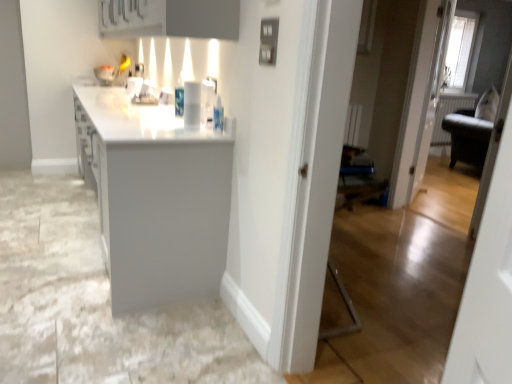
Question: From the image's perspective, would you say white glossy cup at center is positioned over matte gray cabinet at upper center?

Choices:
 (A) yes
 (B) no

Answer: (B)

Question: Considering the relative positions of white glossy cup at center and matte gray cabinet at upper center in the image provided, is white glossy cup at center to the left of matte gray cabinet at upper center from the viewer's perspective?

Choices:
 (A) yes
 (B) no

Answer: (B)

Question: Is white glossy cup at center not near matte gray cabinet at upper center?

Choices:
 (A) no
 (B) yes

Answer: (A)

Question: Is the depth of white glossy cup at center greater than that of matte gray cabinet at upper center?

Choices:
 (A) yes
 (B) no

Answer: (A)

Question: Is white glossy cup at center oriented away from matte gray cabinet at upper center?

Choices:
 (A) yes
 (B) no

Answer: (B)

Question: In terms of size, does matte gray cabinet at upper center appear bigger or smaller than white glossy countertop at center?

Choices:
 (A) small
 (B) big

Answer: (A)

Question: Considering the positions of matte gray cabinet at upper center and white glossy countertop at center in the image, is matte gray cabinet at upper center wider or thinner than white glossy countertop at center?

Choices:
 (A) thin
 (B) wide

Answer: (A)

Question: Visually, is matte gray cabinet at upper center positioned to the left or to the right of white glossy countertop at center?

Choices:
 (A) left
 (B) right

Answer: (B)

Question: From a real-world perspective, is matte gray cabinet at upper center physically located above or below white glossy countertop at center?

Choices:
 (A) above
 (B) below

Answer: (A)

Question: Considering the positions of point (128, 31) and point (200, 94), is point (128, 31) closer or farther from the camera than point (200, 94)?

Choices:
 (A) closer
 (B) farther

Answer: (B)

Question: In the image, is matte gray cabinet at upper center on the left side or the right side of white glossy cup at center?

Choices:
 (A) right
 (B) left

Answer: (B)

Question: Is matte gray cabinet at upper center taller or shorter than white glossy cup at center?

Choices:
 (A) tall
 (B) short

Answer: (A)

Question: Is matte gray cabinet at upper center wider or thinner than white glossy cup at center?

Choices:
 (A) wide
 (B) thin

Answer: (A)

Question: From the image's perspective, is white glossy cup at center positioned above or below matte gray cabinet at upper center?

Choices:
 (A) above
 (B) below

Answer: (B)

Question: From a real-world perspective, is white glossy cup at center physically located above or below matte gray cabinet at upper center?

Choices:
 (A) below
 (B) above

Answer: (A)